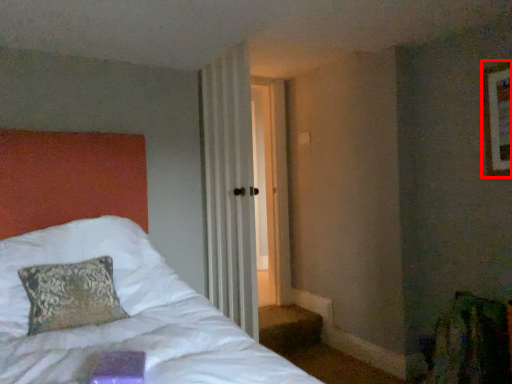
Question: From the image's perspective, where is picture frame (annotated by the red box) located relative to curtain?

Choices:
 (A) below
 (B) above

Answer: (B)